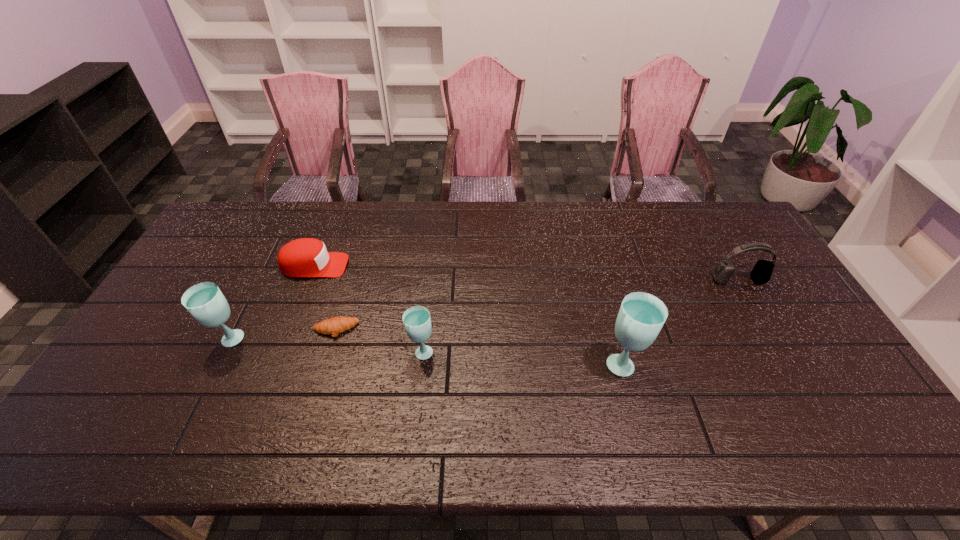
Please point a spot to add another glass on the right. Please provide its 2D coordinates. Your answer should be formatted as a tuple, i.e. [(x, y)], where the tuple contains the x and y coordinates of a point satisfying the conditions above.

[(835, 376)]